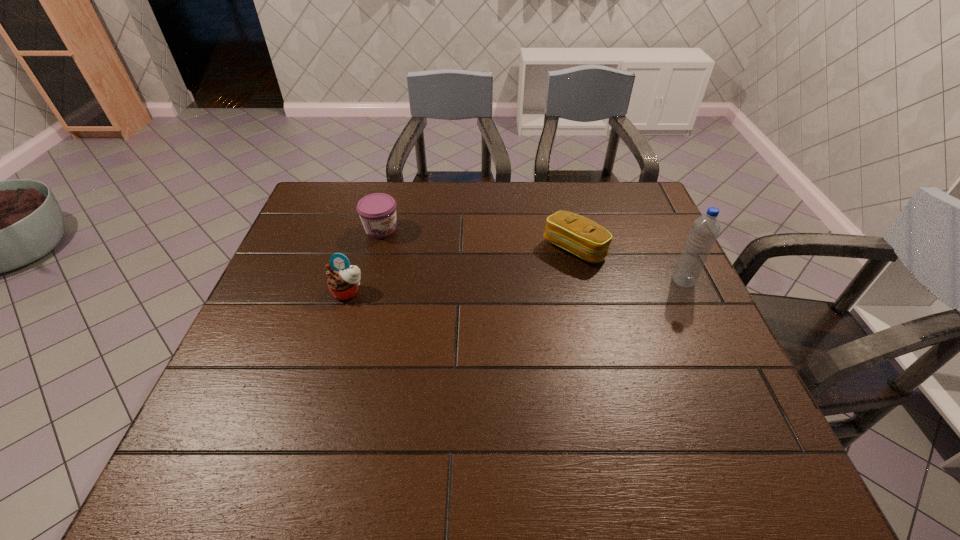
What are the coordinates of `muffin` in the screenshot? It's located at (343, 283).

You are a GUI agent. You are given a task and a screenshot of the screen. Output one action in this format:
    pyautogui.click(x=<x>, y=<y>)
    Task: Click on the tallest object
    
    Given the screenshot: What is the action you would take?
    pyautogui.click(x=705, y=229)

Identify the location of the rightmost object. This screenshot has width=960, height=540. (705, 229).

At what (x,y) coordinates should I click in order to perform the action: click on jam. Please return your answer as a coordinate pair (x, y). Looking at the image, I should click on (377, 211).

Locate an element on the screen. The height and width of the screenshot is (540, 960). clutch bag is located at coordinates (578, 235).

Locate an element on the screen. The width and height of the screenshot is (960, 540). vacant space located on the front-facing side of the muffin is located at coordinates (339, 323).

You are a GUI agent. You are given a task and a screenshot of the screen. Output one action in this format:
    pyautogui.click(x=<x>, y=<y>)
    Task: Click on the vacant space located 0.110m on the back of the rightmost object
    
    Given the screenshot: What is the action you would take?
    pyautogui.click(x=667, y=247)

Locate an element on the screen. vacant space located on the front label of the jam is located at coordinates click(479, 286).

Where is `vacant space positioned 0.280m on the front label of the jam`? vacant space positioned 0.280m on the front label of the jam is located at coordinates (465, 278).

Where is `blank space located on the front label of the jam`? This screenshot has height=540, width=960. blank space located on the front label of the jam is located at coordinates click(425, 255).